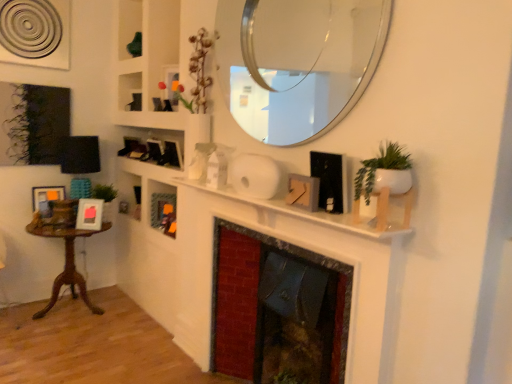
Question: Considering the relative positions of marble fireplace at center and matte wooden picture frame at left, acting as the 3th picture frame starting from the front, in the image provided, is marble fireplace at center to the left of matte wooden picture frame at left, acting as the 3th picture frame starting from the front, from the viewer's perspective?

Choices:
 (A) no
 (B) yes

Answer: (A)

Question: Is marble fireplace at center positioned with its back to matte wooden picture frame at left, which appears as the first picture frame when viewed from the back?

Choices:
 (A) no
 (B) yes

Answer: (A)

Question: From the image's perspective, is marble fireplace at center located beneath matte wooden picture frame at left, which appears as the first picture frame when viewed from the back?

Choices:
 (A) no
 (B) yes

Answer: (B)

Question: Considering the relative sizes of marble fireplace at center and matte wooden picture frame at left, acting as the 3th picture frame starting from the front, in the image provided, is marble fireplace at center wider than matte wooden picture frame at left, acting as the 3th picture frame starting from the front,?

Choices:
 (A) no
 (B) yes

Answer: (B)

Question: From the image's perspective, is marble fireplace at center located above matte wooden picture frame at left, marked as the 3th picture frame in a right-to-left arrangement?

Choices:
 (A) no
 (B) yes

Answer: (A)

Question: Would you say marble fireplace at center contains matte wooden picture frame at left, acting as the 3th picture frame starting from the front?

Choices:
 (A) no
 (B) yes

Answer: (A)

Question: Considering the relative positions of white matte plant pot at upper right and wooden table at left in the image provided, is white matte plant pot at upper right behind wooden table at left?

Choices:
 (A) no
 (B) yes

Answer: (A)

Question: Can you confirm if white matte plant pot at upper right is wider than wooden table at left?

Choices:
 (A) yes
 (B) no

Answer: (B)

Question: Is white matte plant pot at upper right to the right of wooden table at left from the viewer's perspective?

Choices:
 (A) no
 (B) yes

Answer: (B)

Question: From the image's perspective, would you say white matte plant pot at upper right is shown under wooden table at left?

Choices:
 (A) no
 (B) yes

Answer: (A)

Question: Is white matte plant pot at upper right outside wooden table at left?

Choices:
 (A) yes
 (B) no

Answer: (A)

Question: Does white matte plant pot at upper right have a lesser height compared to wooden table at left?

Choices:
 (A) no
 (B) yes

Answer: (B)

Question: Is white matte fireplace at center positioned in front of matte wooden picture frame at left, acting as the 3th picture frame starting from the front?

Choices:
 (A) no
 (B) yes

Answer: (B)